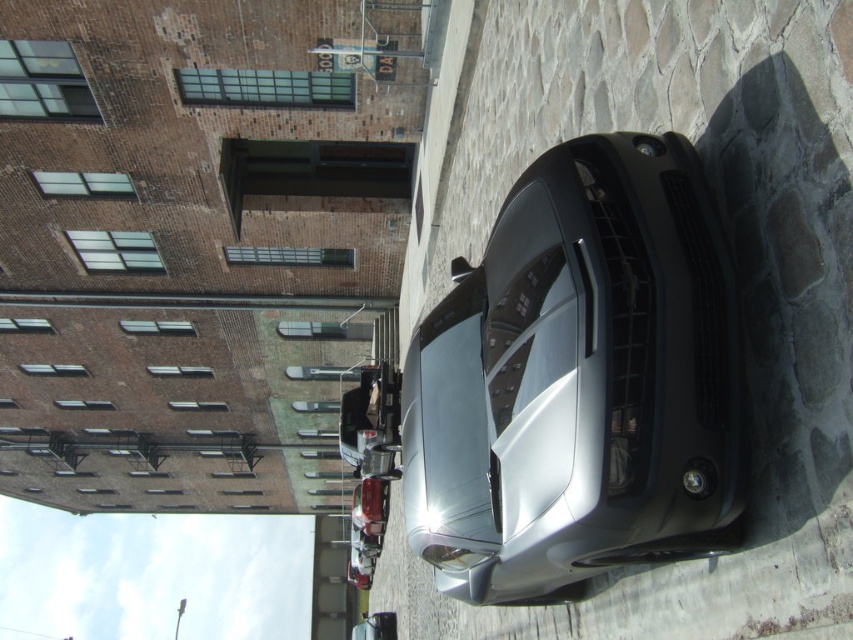
The width and height of the screenshot is (853, 640). What do you see at coordinates (578, 380) in the screenshot?
I see `satin silver car at center` at bounding box center [578, 380].

Is satin silver car at center to the right of shiny metallic car at center from the viewer's perspective?

Indeed, satin silver car at center is positioned on the right side of shiny metallic car at center.

Is point (448, 481) farther from camera compared to point (383, 486)?

No, (448, 481) is in front of (383, 486).

Locate an element on the screen. The height and width of the screenshot is (640, 853). satin silver car at center is located at coordinates (578, 380).